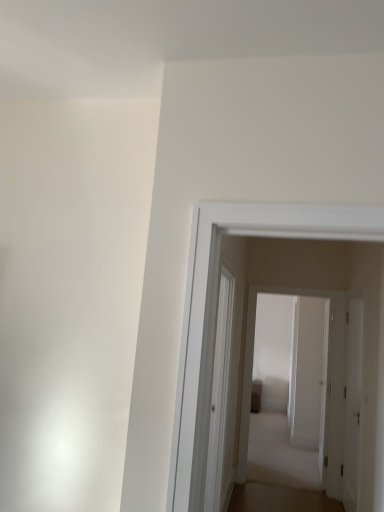
Question: Can you confirm if white glossy door at center, which appears as the 1th door when viewed from the back, is thinner than white matte door at right, which is the first door from front to back?

Choices:
 (A) yes
 (B) no

Answer: (B)

Question: From a real-world perspective, does white glossy door at center, acting as the 2th door starting from the front, sit lower than white matte door at right, positioned as the 2th door in back-to-front order?

Choices:
 (A) no
 (B) yes

Answer: (A)

Question: Is white glossy door at center, which appears as the 1th door when viewed from the back, smaller than white matte door at right, which is the first door from front to back?

Choices:
 (A) no
 (B) yes

Answer: (A)

Question: Considering the relative sizes of white glossy door at center, which appears as the 1th door when viewed from the back, and white matte door at right, which is the first door from front to back, in the image provided, is white glossy door at center, which appears as the 1th door when viewed from the back, taller than white matte door at right, which is the first door from front to back,?

Choices:
 (A) yes
 (B) no

Answer: (A)

Question: Is there a large distance between white glossy door at center, which appears as the 1th door when viewed from the back, and white matte door at right, positioned as the 2th door in back-to-front order?

Choices:
 (A) yes
 (B) no

Answer: (B)

Question: Is white glossy door at center, which appears as the 1th door when viewed from the back, further to camera compared to white matte door at right, which is the first door from front to back?

Choices:
 (A) no
 (B) yes

Answer: (B)

Question: Considering the relative sizes of white matte door at right, positioned as the 2th door in back-to-front order, and transparent glass door at center in the image provided, is white matte door at right, positioned as the 2th door in back-to-front order, smaller than transparent glass door at center?

Choices:
 (A) yes
 (B) no

Answer: (A)

Question: Does white matte door at right, positioned as the 2th door in back-to-front order, touch transparent glass door at center?

Choices:
 (A) no
 (B) yes

Answer: (A)

Question: From a real-world perspective, is white matte door at right, which is the first door from front to back, positioned over transparent glass door at center based on gravity?

Choices:
 (A) yes
 (B) no

Answer: (B)

Question: Is white matte door at right, positioned as the 2th door in back-to-front order, shorter than transparent glass door at center?

Choices:
 (A) yes
 (B) no

Answer: (B)

Question: Is white matte door at right, positioned as the 2th door in back-to-front order, aimed at transparent glass door at center?

Choices:
 (A) yes
 (B) no

Answer: (B)

Question: Is white matte door at right, positioned as the 2th door in back-to-front order, turned away from transparent glass door at center?

Choices:
 (A) yes
 (B) no

Answer: (B)

Question: Is white glossy door at center, acting as the 2th door starting from the front, directly adjacent to transparent glass door at center?

Choices:
 (A) yes
 (B) no

Answer: (B)